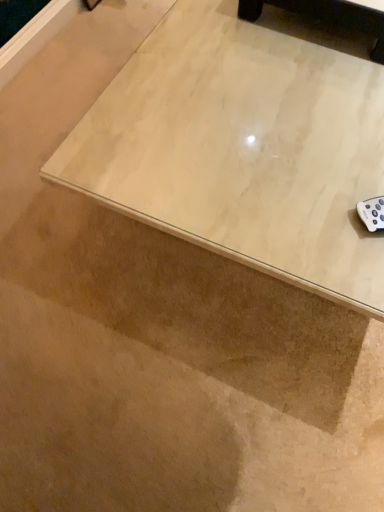
I want to click on free point below light wood coffee table at upper center (from a real-world perspective), so click(x=320, y=26).